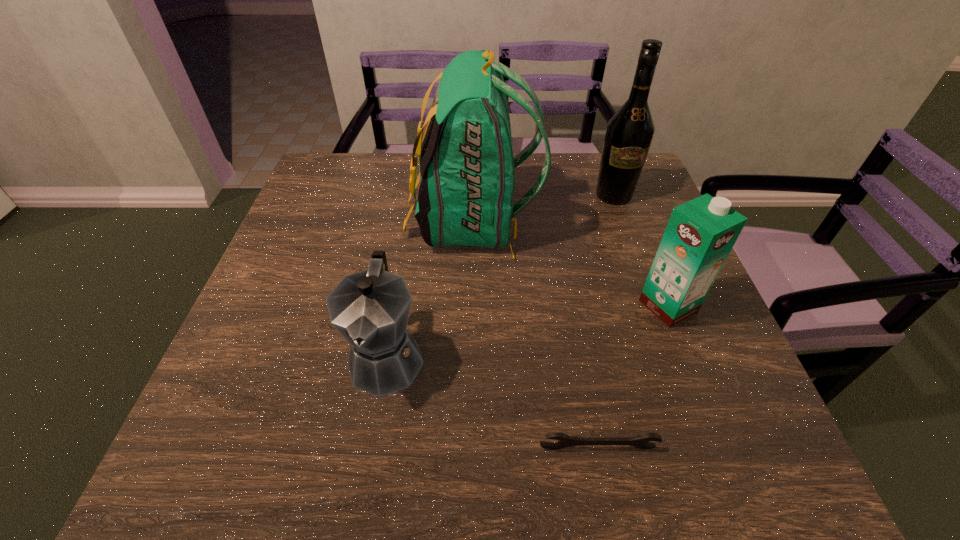
Where is `backpack`? The image size is (960, 540). backpack is located at coordinates (465, 198).

The width and height of the screenshot is (960, 540). Find the location of `wine bottle`. wine bottle is located at coordinates (629, 133).

Image resolution: width=960 pixels, height=540 pixels. In order to click on carton in this screenshot , I will do `click(700, 234)`.

This screenshot has width=960, height=540. Find the location of `the second shortest object`. the second shortest object is located at coordinates [370, 309].

Identify the location of the nearest object. The width and height of the screenshot is (960, 540). (641, 441).

The image size is (960, 540). In order to click on wrench in this screenshot , I will do (x=641, y=441).

The image size is (960, 540). In order to click on blank space located on the back of the backpack in this screenshot , I will do `click(623, 222)`.

In order to click on vacant space located on the label of the wine bottle in this screenshot , I will do `click(660, 324)`.

You are a GUI agent. You are given a task and a screenshot of the screen. Output one action in this format:
    pyautogui.click(x=<x>, y=<y>)
    Task: Click on the free space located 0.230m on the left of the carton
    The height and width of the screenshot is (540, 960).
    Given the screenshot: What is the action you would take?
    pyautogui.click(x=532, y=306)

The width and height of the screenshot is (960, 540). I want to click on vacant space located 0.050m at the spout of the coffeepot, so click(373, 434).